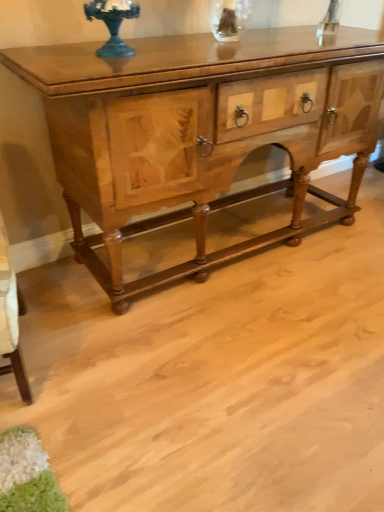
At what (x,y) coordinates should I click in order to perform the action: click on free space in front of wooden cabinet at center. Please return your answer as a coordinate pair (x, y). The image size is (384, 512). Looking at the image, I should click on (224, 361).